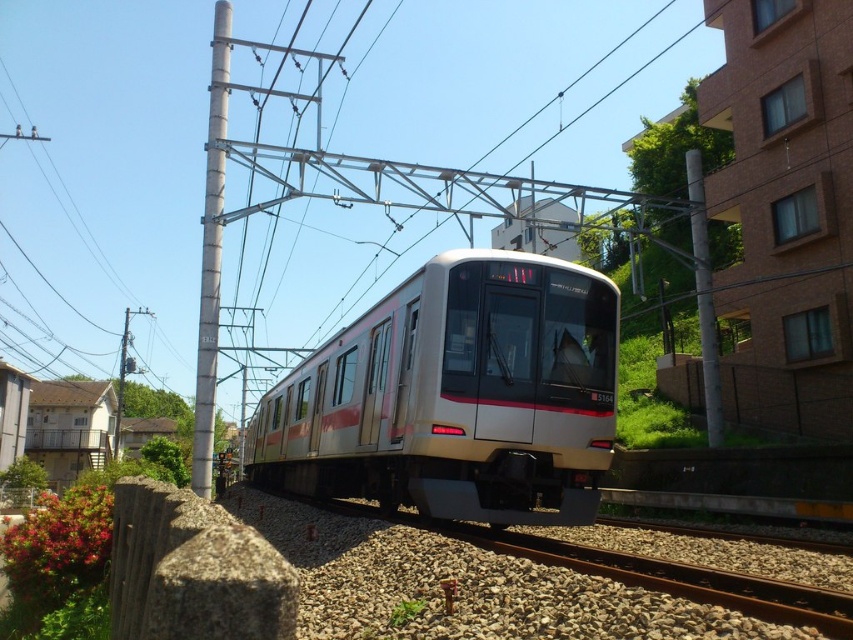
Question: In this image, where is metallic gray pole at left located relative to metallic gray pole at upper center?

Choices:
 (A) below
 (B) above

Answer: (B)

Question: Which object is farther from the camera taking this photo?

Choices:
 (A) silver metallic train at center
 (B) metallic gray pole at left

Answer: (B)

Question: Which of the following is the closest to the observer?

Choices:
 (A) (194, 410)
 (B) (688, 196)
 (C) (321, 468)

Answer: (C)

Question: Is metallic gray pole at left positioned behind metallic gray pole at upper center?

Choices:
 (A) yes
 (B) no

Answer: (B)

Question: Is silver metallic train at center below metallic gray pole at left?

Choices:
 (A) no
 (B) yes

Answer: (B)

Question: Which of the following is the farthest from the observer?

Choices:
 (A) (373, 492)
 (B) (210, 145)

Answer: (B)